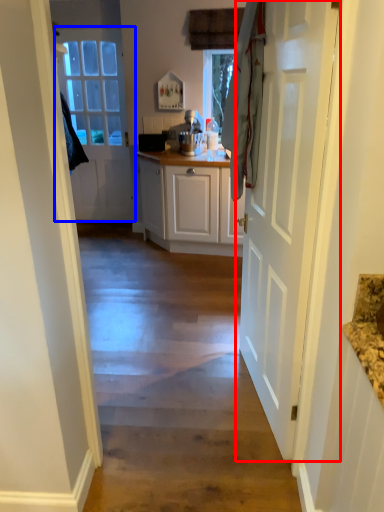
Question: Which of the following is the closest to the observer, door (highlighted by a red box) or door (highlighted by a blue box)?

Choices:
 (A) door
 (B) door

Answer: (A)